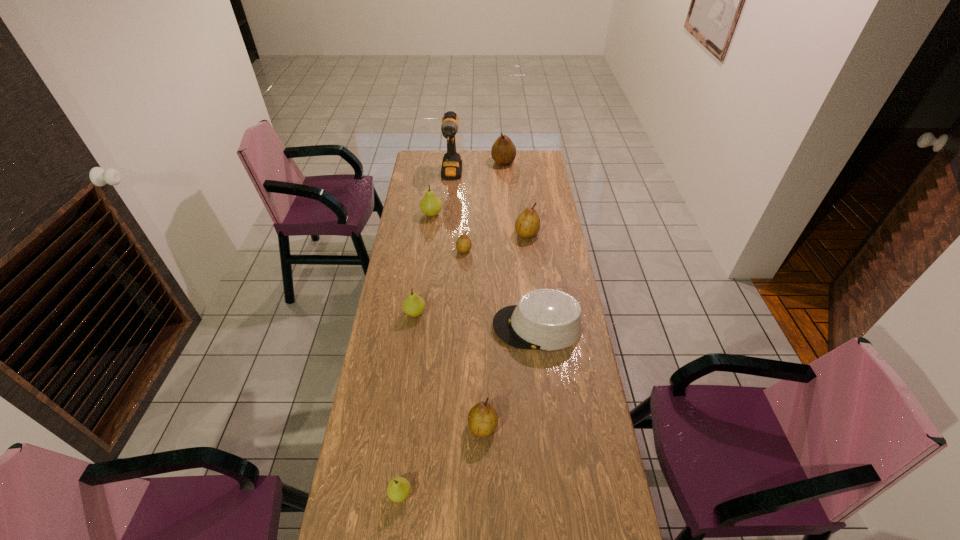
The height and width of the screenshot is (540, 960). I want to click on unoccupied position between the second nearest brown pear and the biggest green pear, so click(x=448, y=232).

Where is `free space between the hat and the second biggest green pear`? The image size is (960, 540). free space between the hat and the second biggest green pear is located at coordinates (476, 320).

Find the location of `free space that is in between the second farthest green pear and the hat`. free space that is in between the second farthest green pear and the hat is located at coordinates tap(476, 320).

In order to click on free point between the biggest green pear and the third nearest pear in this screenshot , I will do `click(423, 264)`.

The height and width of the screenshot is (540, 960). In order to click on blank region between the farthest brown pear and the fifth nearest pear in this screenshot , I will do `click(515, 198)`.

Image resolution: width=960 pixels, height=540 pixels. In order to click on object identified as the seventh closest to the third farthest object in this screenshot , I will do `click(482, 419)`.

Where is `object that is the closest to the biggest green pear`? The width and height of the screenshot is (960, 540). object that is the closest to the biggest green pear is located at coordinates (451, 168).

Choose which pear is the fifth nearest neighbor to the biggest green pear. Please provide its 2D coordinates. Your answer should be formatted as a tuple, i.e. [(x, y)], where the tuple contains the x and y coordinates of a point satisfying the conditions above.

[(482, 419)]

What are the coordinates of `pear that is the second nearest to the nearest object` in the screenshot? It's located at (413, 305).

I want to click on brown pear identified as the closest to the fifth farthest pear, so (x=463, y=244).